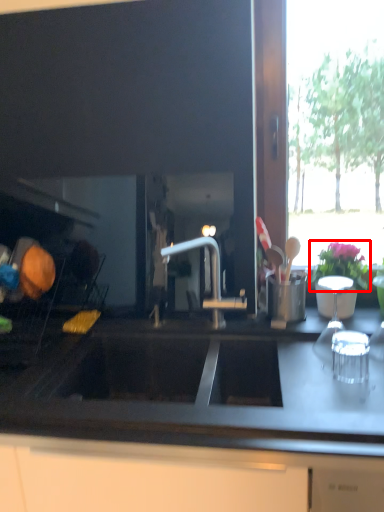
Question: From the image's perspective, considering the relative positions of flower (annotated by the red box) and countertop in the image provided, where is flower (annotated by the red box) located with respect to the staircase?

Choices:
 (A) above
 (B) below

Answer: (A)